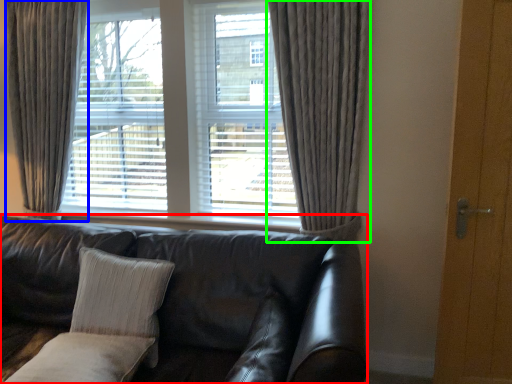
Question: Based on their relative distances, which object is nearer to studio couch (highlighted by a red box)? Choose from curtain (highlighted by a blue box) and curtain (highlighted by a green box).

Choices:
 (A) curtain
 (B) curtain

Answer: (B)